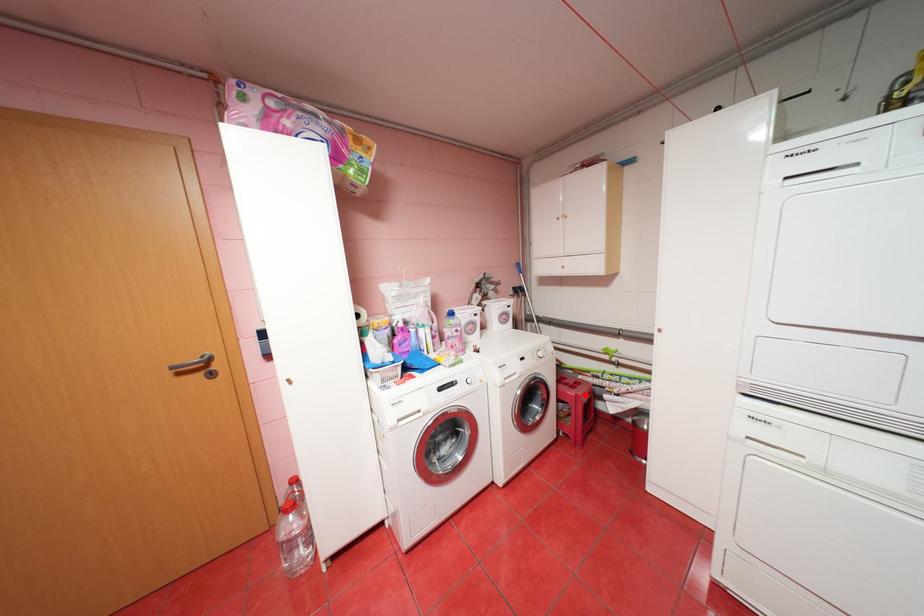
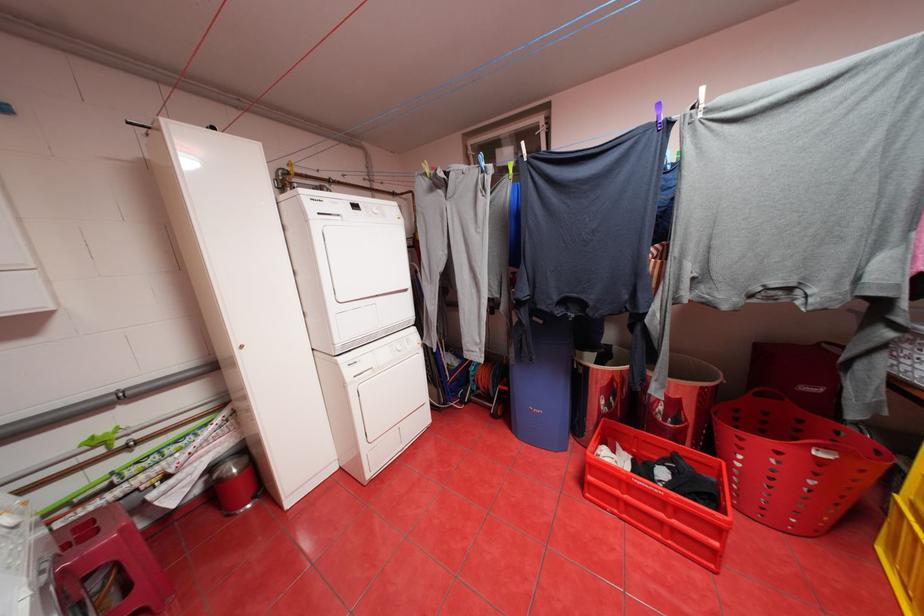
Find the pixel in the second image that matches the highlighted location in the first image.

(130, 530)